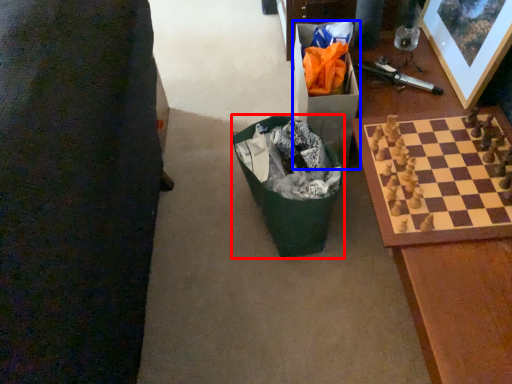
Question: Which point is further to the camera, recycling bin (highlighted by a red box) or cardboard box (highlighted by a blue box)?

Choices:
 (A) recycling bin
 (B) cardboard box

Answer: (B)